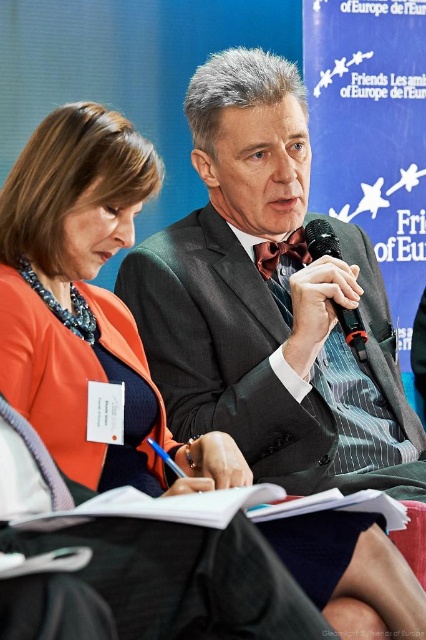
Between dark gray suit at center and black plastic microphone at center, which one appears on the right side from the viewer's perspective?

Positioned to the right is black plastic microphone at center.

Which is above, dark gray suit at center or black plastic microphone at center?

black plastic microphone at center is higher up.

Locate an element on the screen. dark gray suit at center is located at coordinates (270, 301).